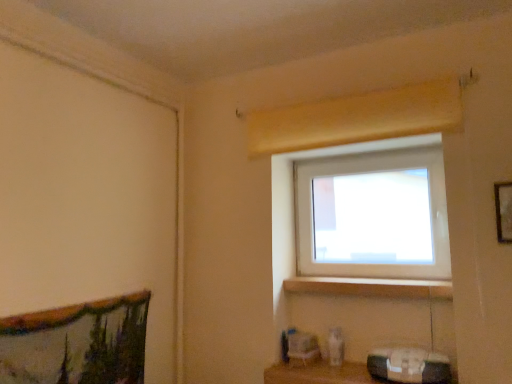
Question: Is wooden shelf at lower center smaller than white plastic window at upper center?

Choices:
 (A) yes
 (B) no

Answer: (A)

Question: Could you tell me if wooden shelf at lower center is turned towards white plastic window at upper center?

Choices:
 (A) no
 (B) yes

Answer: (A)

Question: Is the depth of wooden shelf at lower center greater than that of white plastic window at upper center?

Choices:
 (A) no
 (B) yes

Answer: (A)

Question: Is wooden shelf at lower center at the right side of white plastic window at upper center?

Choices:
 (A) no
 (B) yes

Answer: (A)

Question: Is wooden shelf at lower center thinner than white plastic window at upper center?

Choices:
 (A) yes
 (B) no

Answer: (B)

Question: Is wooden shelf at lower center inside the boundaries of wooden at lower center, or outside?

Choices:
 (A) inside
 (B) outside

Answer: (B)

Question: Based on their sizes in the image, would you say wooden shelf at lower center is bigger or smaller than wooden at lower center?

Choices:
 (A) small
 (B) big

Answer: (B)

Question: Relative to wooden at lower center, is wooden shelf at lower center in front or behind?

Choices:
 (A) behind
 (B) front

Answer: (B)

Question: Visually, is wooden shelf at lower center positioned to the left or to the right of wooden at lower center?

Choices:
 (A) left
 (B) right

Answer: (A)

Question: From the image's perspective, is white plastic window at upper center positioned above or below wooden picture frame at upper right?

Choices:
 (A) below
 (B) above

Answer: (A)

Question: Considering the positions of white plastic window at upper center and wooden picture frame at upper right in the image, is white plastic window at upper center taller or shorter than wooden picture frame at upper right?

Choices:
 (A) tall
 (B) short

Answer: (A)

Question: Is white plastic window at upper center wider or thinner than wooden picture frame at upper right?

Choices:
 (A) thin
 (B) wide

Answer: (B)

Question: Considering the positions of white plastic window at upper center and wooden picture frame at upper right in the image, is white plastic window at upper center bigger or smaller than wooden picture frame at upper right?

Choices:
 (A) big
 (B) small

Answer: (A)

Question: From a real-world perspective, is wooden shelf at lower center above or below white plastic window at upper center?

Choices:
 (A) above
 (B) below

Answer: (B)

Question: Is point (308, 375) closer or farther from the camera than point (350, 150)?

Choices:
 (A) closer
 (B) farther

Answer: (A)